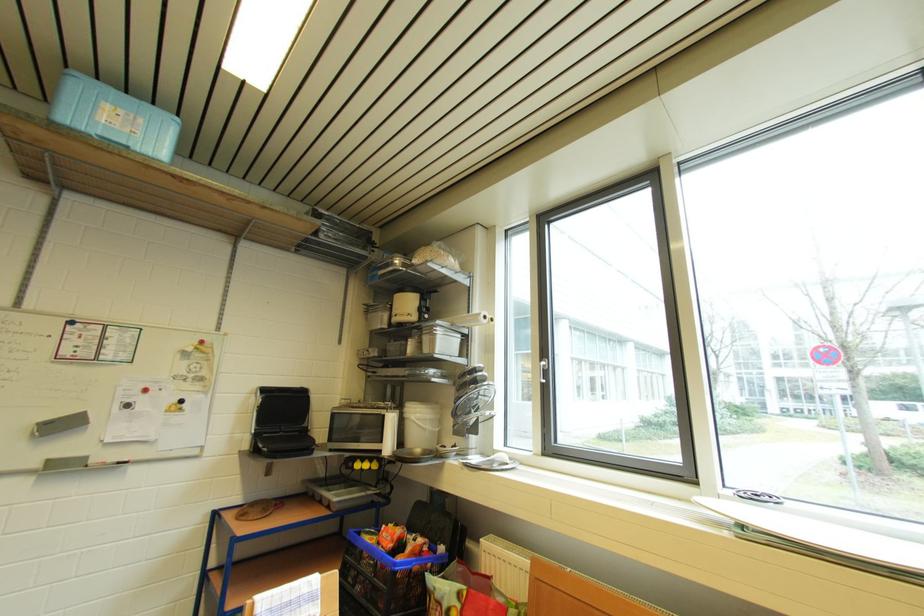
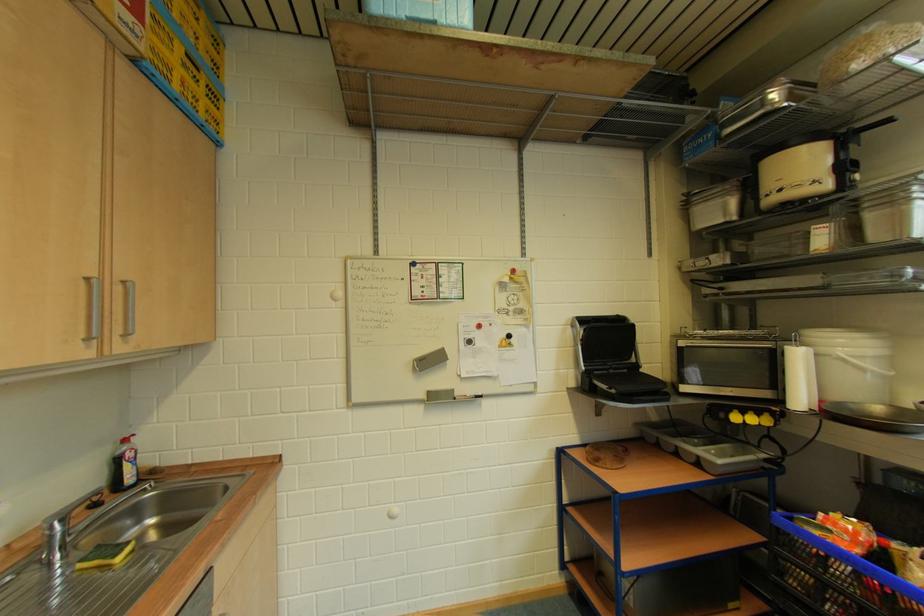
Find the pixel in the second image that matches (423,422) in the first image.

(858, 360)